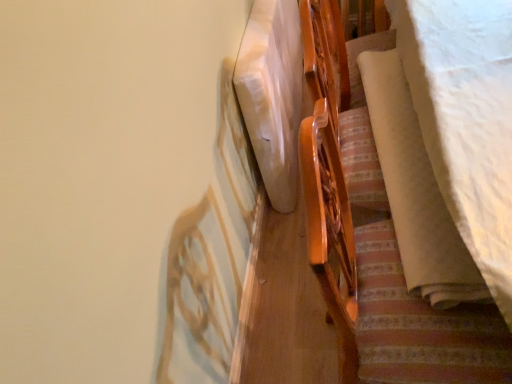
Question: Is white matte mattress at center surrounded by white soft fabric at right?

Choices:
 (A) no
 (B) yes

Answer: (A)

Question: Considering the relative positions of white soft fabric at right and white matte mattress at center in the image provided, is white soft fabric at right to the left of white matte mattress at center from the viewer's perspective?

Choices:
 (A) no
 (B) yes

Answer: (A)

Question: From the image's perspective, is white soft fabric at right below white matte mattress at center?

Choices:
 (A) no
 (B) yes

Answer: (B)

Question: From a real-world perspective, is white soft fabric at right below white matte mattress at center?

Choices:
 (A) yes
 (B) no

Answer: (B)

Question: Can you confirm if white soft fabric at right is bigger than white matte mattress at center?

Choices:
 (A) yes
 (B) no

Answer: (B)

Question: In terms of width, does wooden bed frame at upper right look wider or thinner when compared to white matte mattress at center?

Choices:
 (A) wide
 (B) thin

Answer: (A)

Question: Does point (362, 279) appear closer or farther from the camera than point (264, 72)?

Choices:
 (A) closer
 (B) farther

Answer: (A)

Question: Looking at the image, does wooden bed frame at upper right seem bigger or smaller compared to white matte mattress at center?

Choices:
 (A) small
 (B) big

Answer: (B)

Question: From the image's perspective, is wooden bed frame at upper right above or below white matte mattress at center?

Choices:
 (A) above
 (B) below

Answer: (B)

Question: From a real-world perspective, relative to wooden bed frame at upper right, is white matte mattress at center vertically above or below?

Choices:
 (A) above
 (B) below

Answer: (B)

Question: Considering the positions of point (282, 92) and point (464, 307), is point (282, 92) closer or farther from the camera than point (464, 307)?

Choices:
 (A) closer
 (B) farther

Answer: (B)

Question: Looking at their shapes, would you say white matte mattress at center is wider or thinner than wooden bed frame at upper right?

Choices:
 (A) wide
 (B) thin

Answer: (B)

Question: In the image, is white matte mattress at center positioned in front of or behind wooden bed frame at upper right?

Choices:
 (A) front
 (B) behind

Answer: (B)

Question: Considering the positions of white matte mattress at center and white soft fabric at right in the image, is white matte mattress at center taller or shorter than white soft fabric at right?

Choices:
 (A) short
 (B) tall

Answer: (B)

Question: Choose the correct answer: Is white matte mattress at center inside white soft fabric at right or outside it?

Choices:
 (A) inside
 (B) outside

Answer: (B)